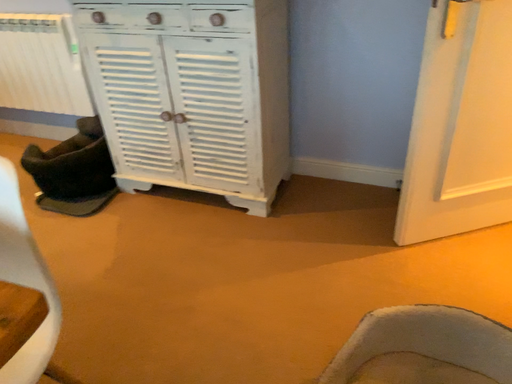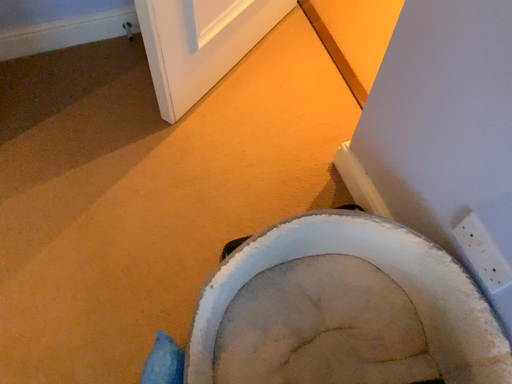
Question: How did the camera likely rotate when shooting the video?

Choices:
 (A) rotated left
 (B) rotated right

Answer: (B)